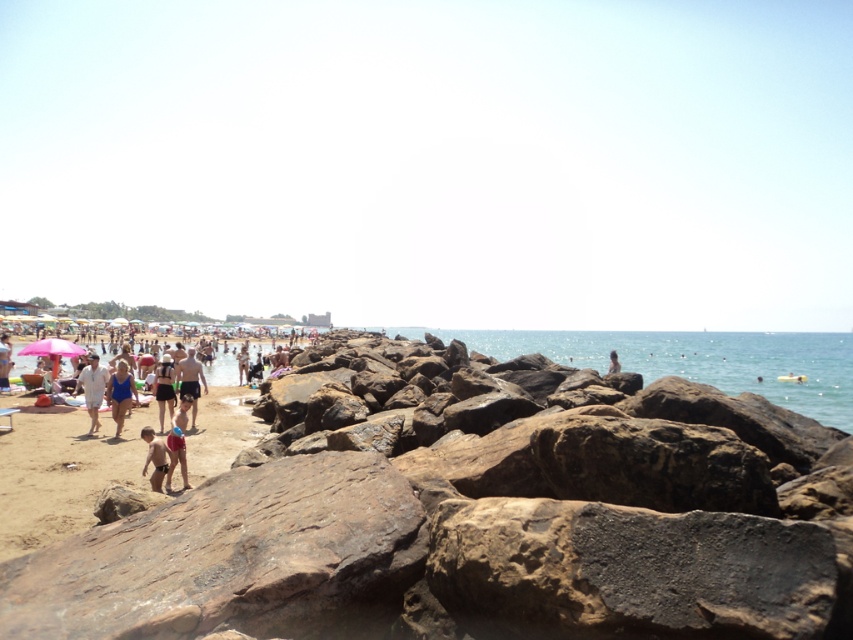
You are a photographer trying to capture a wide shot of the beach scene. You notice the brown rough rocks at center and the white cotton shirt at left. Based on their sizes, which object would likely block more of the background in your photo?

The brown rough rocks at center might be wider than the white cotton shirt at left, so they would likely block more of the background in your photo.